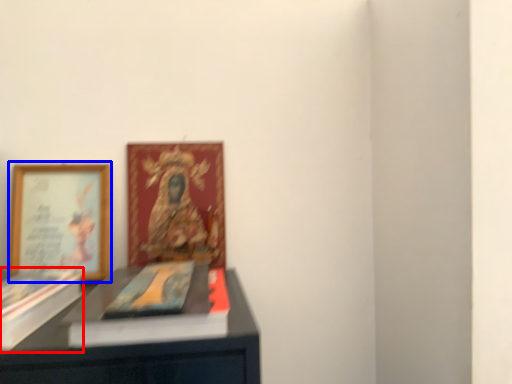
Question: Which of the following is the farthest to the observer, paperback book (highlighted by a red box) or picture frame (highlighted by a blue box)?

Choices:
 (A) paperback book
 (B) picture frame

Answer: (B)